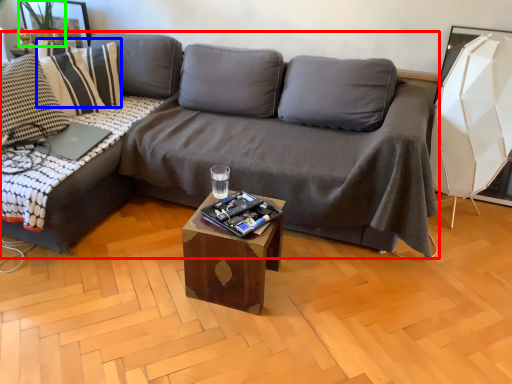
Question: Considering the real-world distances, which object is farthest from studio couch (highlighted by a red box)? pillow (highlighted by a blue box) or plant (highlighted by a green box)?

Choices:
 (A) pillow
 (B) plant

Answer: (B)